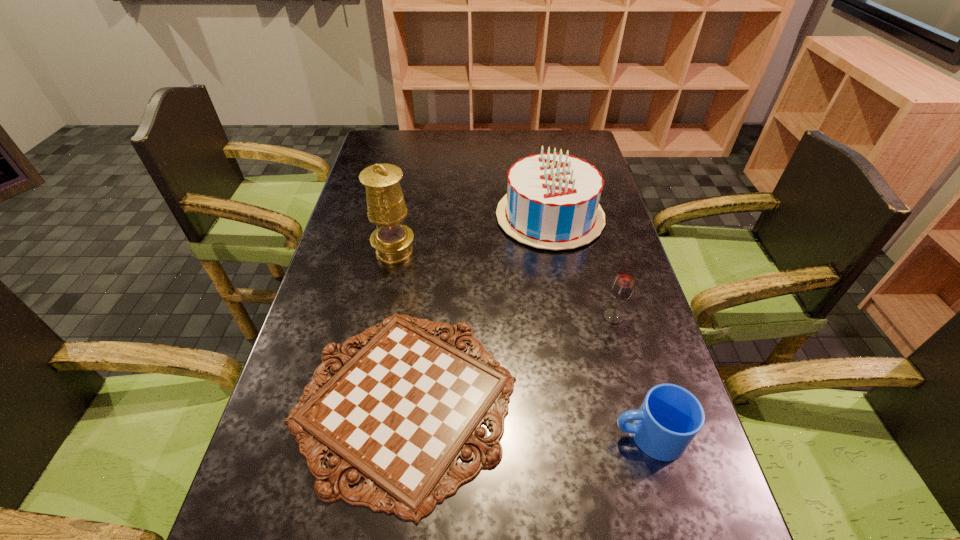
Where is `free space at the far left corner`? The height and width of the screenshot is (540, 960). free space at the far left corner is located at coordinates (380, 134).

Where is `free space at the far right corner of the desktop`? This screenshot has width=960, height=540. free space at the far right corner of the desktop is located at coordinates (569, 135).

At what (x,y) coordinates should I click in order to perform the action: click on free area in between the third shortest object and the oil lamp. Please return your answer as a coordinate pair (x, y). Looking at the image, I should click on (504, 284).

I want to click on free point between the mug and the glass drink container, so click(631, 376).

I want to click on free space between the third tallest object and the fourth shortest object, so click(x=582, y=267).

I want to click on free space that is in between the shortest object and the third shortest object, so click(509, 359).

This screenshot has width=960, height=540. I want to click on unoccupied area between the oil lamp and the birthday cake, so [472, 234].

Locate an element on the screen. Image resolution: width=960 pixels, height=540 pixels. empty space between the mug and the tallest object is located at coordinates (521, 343).

Locate which object is the third closest to the oil lamp. Please provide its 2D coordinates. Your answer should be formatted as a tuple, i.e. [(x, y)], where the tuple contains the x and y coordinates of a point satisfying the conditions above.

[(622, 287)]

What are the coordinates of `object that ranks as the third closest to the shortest object` in the screenshot? It's located at (622, 287).